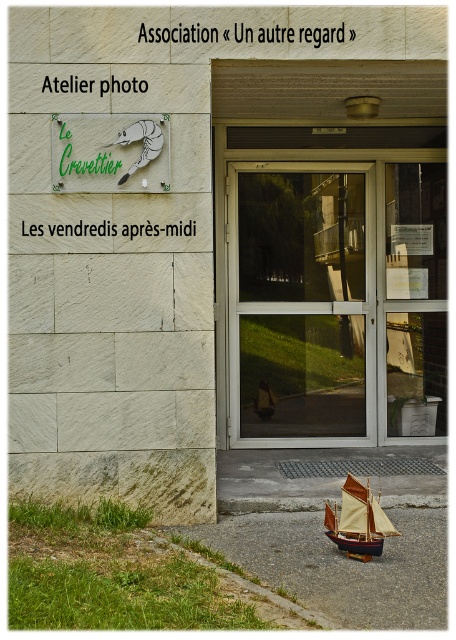
You are standing in front of the building and want to enter through the transparent glass door at center. Based on the coordinates provided, can you determine if the door is positioned to your left or right side?

The coordinates of the transparent glass door at center are at point (300, 305). Since the x coordinate is 0.477, which is slightly less than 0.5, the door is positioned to your left side.

You are standing in front of the building and want to take a photo of the signboard. There are two points marked on the image at coordinates point (167,148) and point (368,522). Which point is closer to your camera lens?

Point (167,148) is further to the camera than point (368,522), so the point closer to the camera lens is point (167,148).

You are standing in front of the building and want to locate the green painted sign at upper left. According to the coordinates provided, where should you look relative to the signboard?

The green painted sign at upper left is located at point (109,152), which means it is positioned to the upper left relative to the signboard.